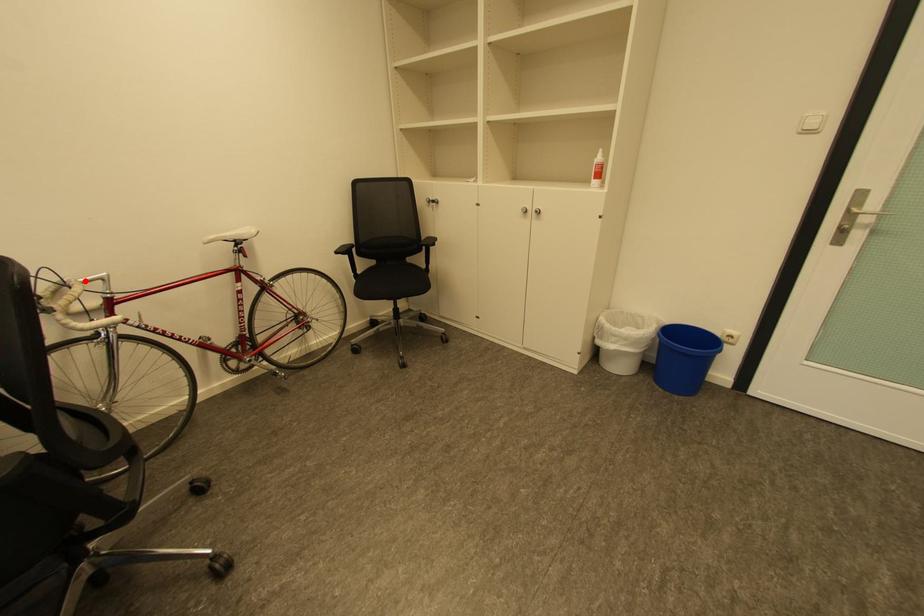
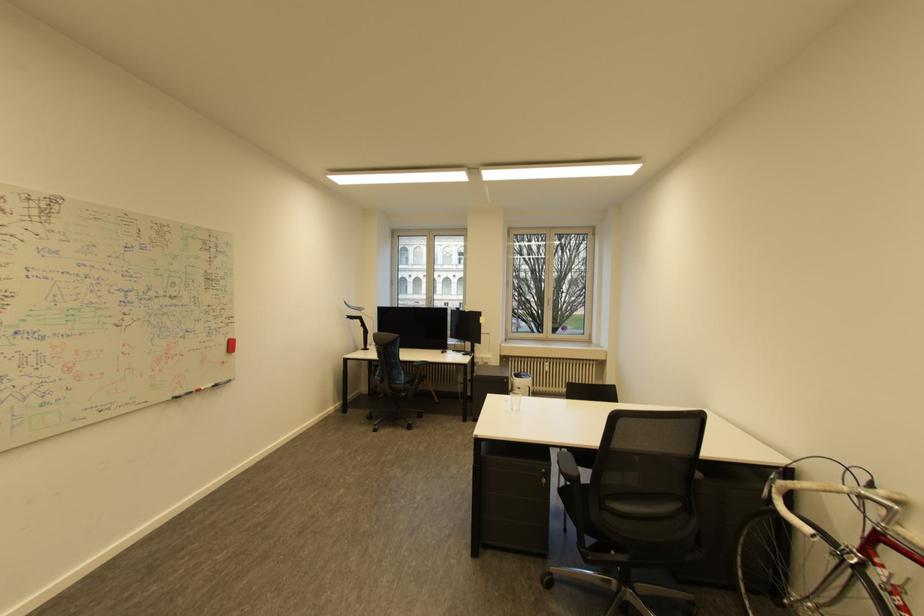
Question: I am providing you with two images of the same scene from different viewpoints. Image1 has a red point marked. In image2, the corresponding 3D location appears at what relative position? Reply with the corresponding letter.

Choices:
 (A) Closer
 (B) Farther

Answer: (B)